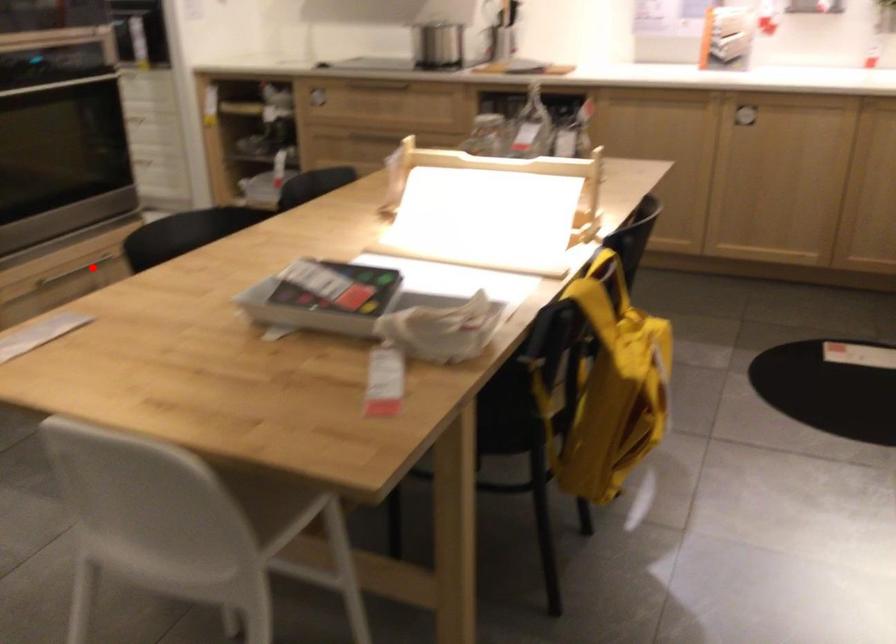
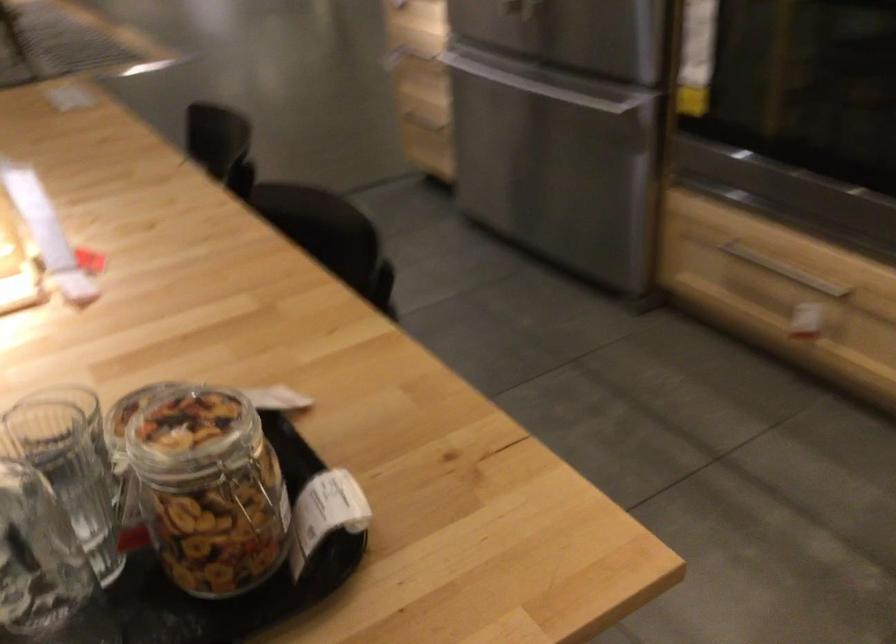
In the second image, find the point that corresponds to the highlighted location in the first image.

(784, 270)